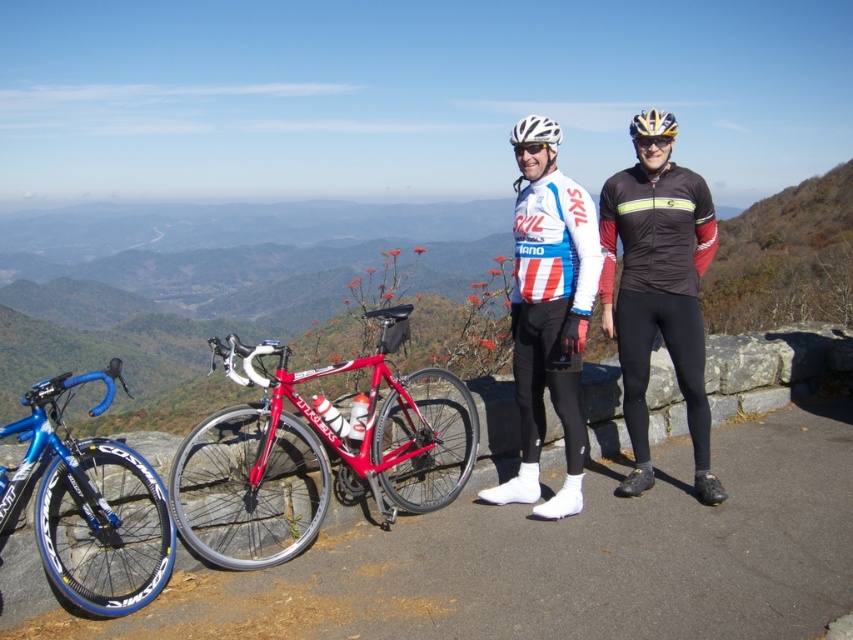
You are a hiker who wants to identify the cyclist wearing the white jersey at center and the white matte helmet at center. Based on the scene description, which item is positioned to the left of the other?

The white jersey at center is positioned to the left of the white matte helmet at center.

You are a photographer planning to take a portrait of the cyclists wearing the black jersey at center and the white matte helmet at center. To ensure both subjects are visible in the frame, should you adjust your camera angle to look upward or downward?

The black jersey at center is below the white matte helmet at center, so you should adjust your camera angle to look upward to capture both the black jersey at center and the white matte helmet at center in the frame.